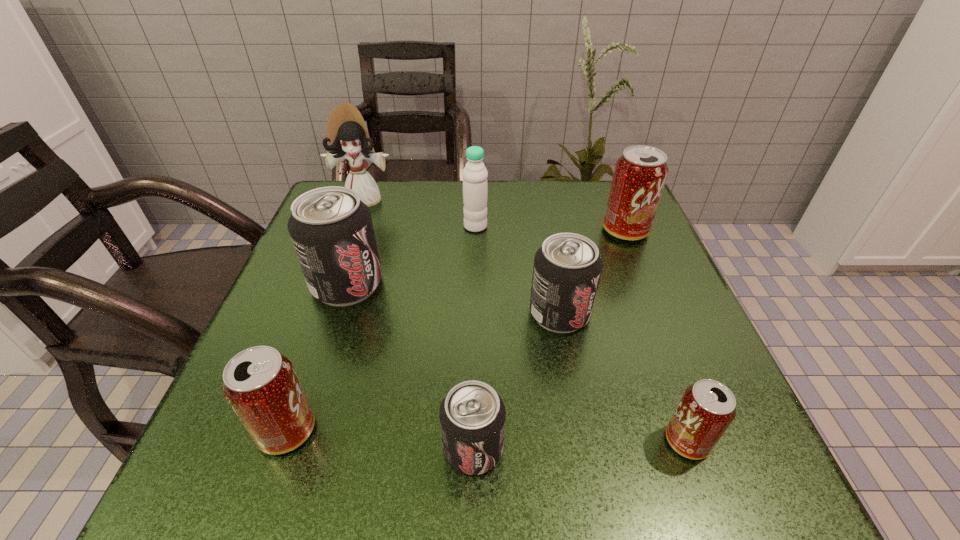
The height and width of the screenshot is (540, 960). I want to click on the fourth soda can from right to left, so click(472, 415).

Image resolution: width=960 pixels, height=540 pixels. Find the location of `the second black soda can from left to right`. the second black soda can from left to right is located at coordinates [472, 415].

Image resolution: width=960 pixels, height=540 pixels. What are the coordinates of `free space located at the front face of the farthest object` in the screenshot? It's located at coord(320,325).

Identify the location of free space located 0.180m on the left of the water bottle. This screenshot has height=540, width=960. (389, 226).

You are a GUI agent. You are given a task and a screenshot of the screen. Output one action in this format:
    pyautogui.click(x=<x>, y=<y>)
    Task: Click on the free region located 0.160m on the back of the biggest red soda can
    Image resolution: width=960 pixels, height=540 pixels.
    Given the screenshot: What is the action you would take?
    pyautogui.click(x=606, y=184)

The width and height of the screenshot is (960, 540). In order to click on vacant space located 0.350m on the front of the leftmost black soda can in this screenshot , I will do `click(276, 498)`.

This screenshot has width=960, height=540. In order to click on free location located on the left of the rightmost black soda can in this screenshot , I will do `click(341, 313)`.

Locate an element on the screen. The image size is (960, 540). vacant area situated on the right of the second smallest red soda can is located at coordinates (454, 430).

Where is `vacant space positioned on the left of the smallest red soda can`? The height and width of the screenshot is (540, 960). vacant space positioned on the left of the smallest red soda can is located at coordinates (443, 441).

The width and height of the screenshot is (960, 540). Find the location of `blank area located on the right of the third soda can from left to right`. blank area located on the right of the third soda can from left to right is located at coordinates (571, 448).